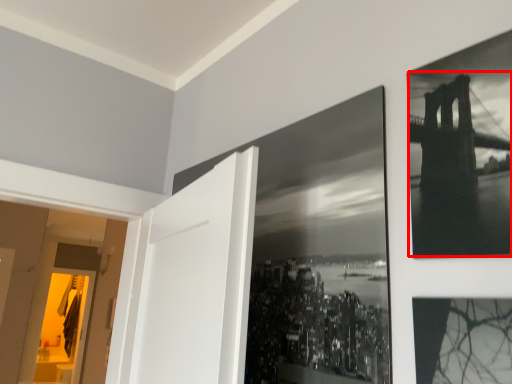
Question: Considering the relative positions of Golden Gate Bridge (annotated by the red box) and picture frame in the image provided, where is Golden Gate Bridge (annotated by the red box) located with respect to the staircase?

Choices:
 (A) left
 (B) right

Answer: (B)